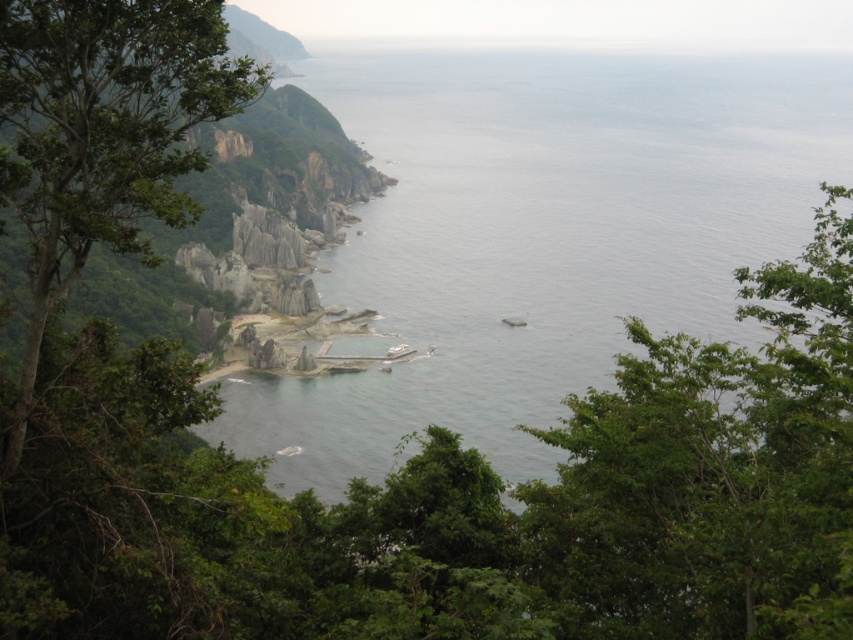
You are standing at the top of the cliff looking out over the coastal landscape. There is a green leafy tree at center. Where would you look to find the point marked at coordinate (459, 500)?

The point marked at coordinate (459, 500) corresponds to the green leafy tree at center.

You are standing at the top of the cliff overlooking the coastal landscape. You see the green leafy tree at center and the clear blue water at center. Which object is closer to your current position?

The green leafy tree at center is located below the clear blue water at center, so the clear blue water at center is closer to your position at the top of the cliff.